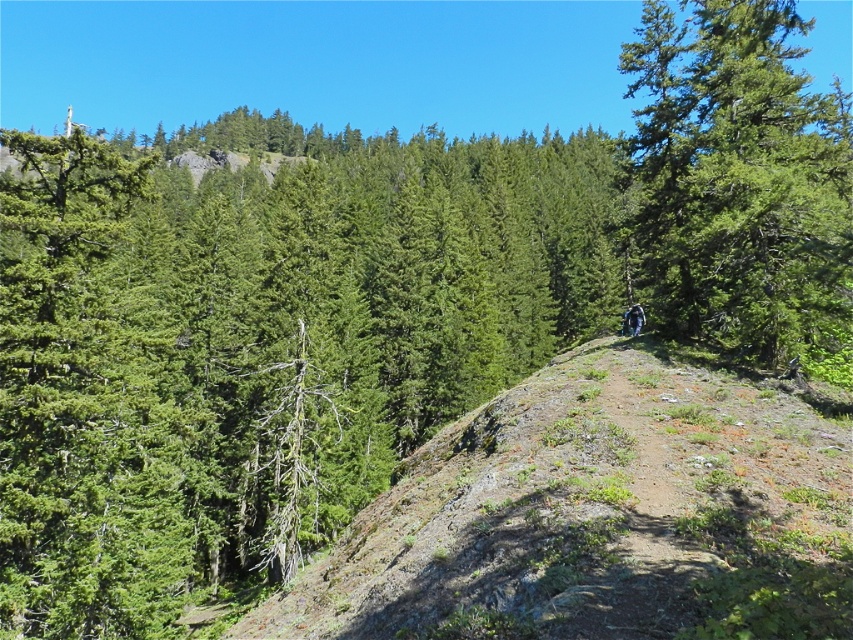
Question: Is green textured tree at upper center to the left of green textured tree at center from the viewer's perspective?

Choices:
 (A) yes
 (B) no

Answer: (A)

Question: Is green textured tree at upper center smaller than dull brown dirt at center?

Choices:
 (A) no
 (B) yes

Answer: (A)

Question: Which object is closer to the camera taking this photo?

Choices:
 (A) dull brown dirt at center
 (B) green textured tree at center
 (C) green textured tree at upper center

Answer: (A)

Question: Which point is closer to the camera?

Choices:
 (A) (645, 240)
 (B) (199, 516)
 (C) (366, 508)

Answer: (C)

Question: Which object is the closest to the dull brown dirt at center?

Choices:
 (A) green textured tree at upper center
 (B) green textured tree at center

Answer: (B)

Question: Does dull brown dirt at center appear under green textured tree at center?

Choices:
 (A) yes
 (B) no

Answer: (A)